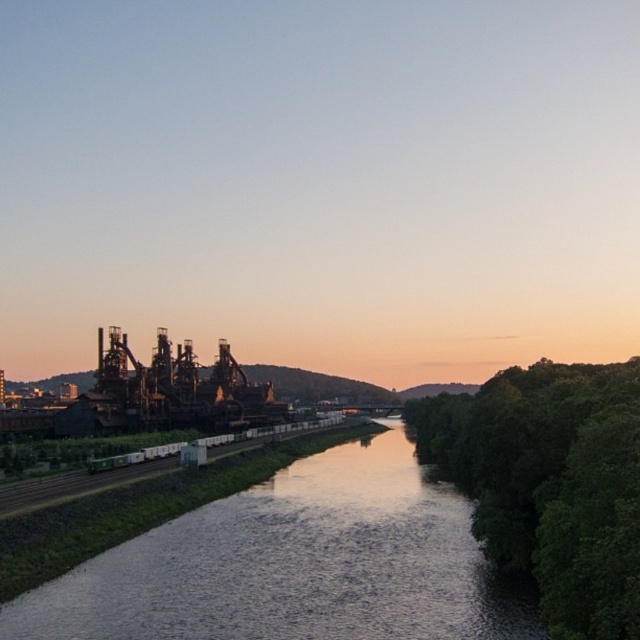
Is dark reflective water at center to the left of green leafy trees at right from the viewer's perspective?

Correct, you'll find dark reflective water at center to the left of green leafy trees at right.

Where is `dark reflective water at center`? dark reflective water at center is located at coordinates (292, 564).

Is point (154, 616) positioned behind point (637, 368)?

No.

This screenshot has width=640, height=640. I want to click on dark reflective water at center, so click(292, 564).